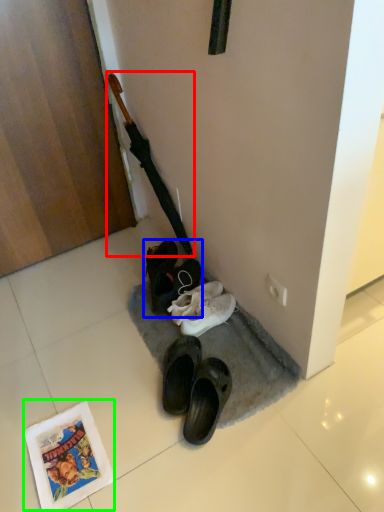
Question: Estimate the real-world distances between objects in this image. Which object is closer to crucifix (highlighted by a red box), footwear (highlighted by a blue box) or comic book (highlighted by a green box)?

Choices:
 (A) footwear
 (B) comic book

Answer: (A)